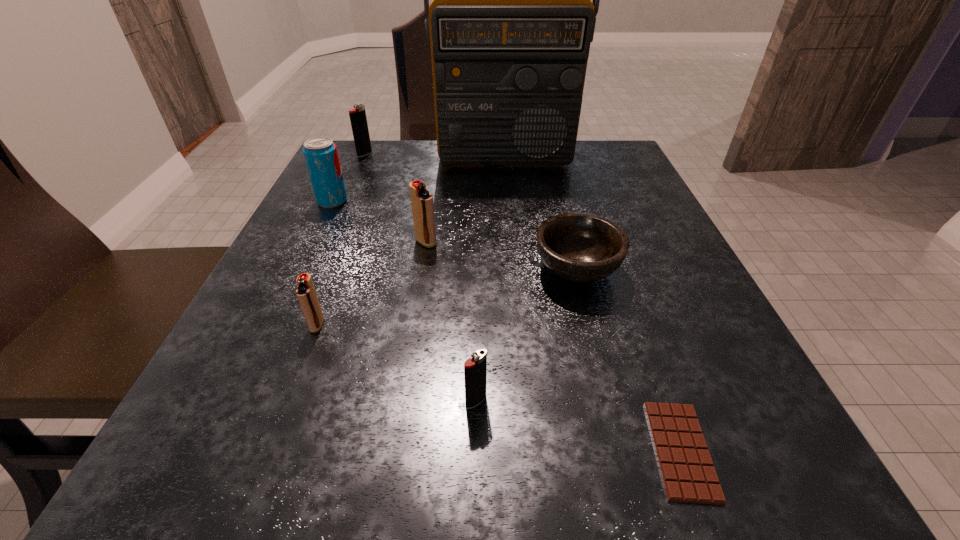
At what (x,y) coordinates should I click in order to perform the action: click on unoccupied position between the candy bar and the seventh tallest object. Please return your answer as a coordinate pair (x, y). The width and height of the screenshot is (960, 540). Looking at the image, I should click on (629, 360).

This screenshot has height=540, width=960. Identify the location of free space between the bigger red igniter and the second igniter from left to right. (372, 284).

Locate an element on the screen. The width and height of the screenshot is (960, 540). empty space that is in between the brown bowl and the candy bar is located at coordinates point(629,360).

The height and width of the screenshot is (540, 960). Identify the location of unoccupied position between the brown bowl and the shortest object. [x=629, y=360].

Locate an element on the screen. The image size is (960, 540). free space between the shortest object and the sixth farthest object is located at coordinates (499, 388).

Where is `free point between the third nearest object and the rightmost igniter`? free point between the third nearest object and the rightmost igniter is located at coordinates (396, 363).

Identify the location of free spot between the brown candy bar and the seventh tallest object. The height and width of the screenshot is (540, 960). (629, 360).

Where is `free point between the radio receiver and the leftmost igniter`? free point between the radio receiver and the leftmost igniter is located at coordinates (435, 157).

Select which object appears as the closest to the third nearest object. Please provide its 2D coordinates. Your answer should be formatted as a tuple, i.e. [(x, y)], where the tuple contains the x and y coordinates of a point satisfying the conditions above.

[(421, 200)]

I want to click on object that is the sixth nearest to the second shortest object, so click(x=320, y=153).